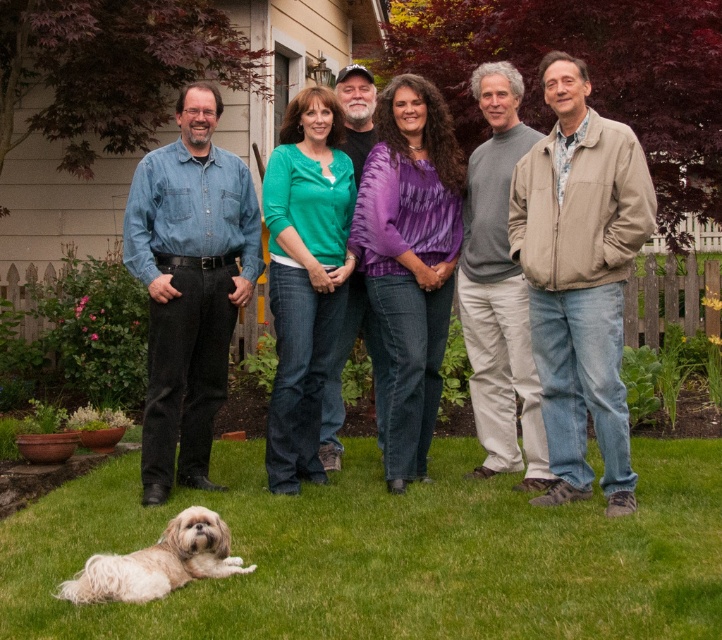
Is point (570, 461) closer to camera compared to point (609, 168)?

No, it is behind (609, 168).

Is denim shirt at center positioned before tan suede jacket at right?

No, denim shirt at center is further to the viewer.

What do you see at coordinates (583, 288) in the screenshot? Image resolution: width=722 pixels, height=640 pixels. I see `denim shirt at center` at bounding box center [583, 288].

I want to click on denim shirt at center, so click(x=583, y=288).

Consider the image. Is green grass at lower center above tan suede jacket at right?

Incorrect, green grass at lower center is not positioned above tan suede jacket at right.

Is green grass at lower center below tan suede jacket at right?

Yes, green grass at lower center is below tan suede jacket at right.

At what (x,y) coordinates should I click in order to perform the action: click on green grass at lower center. Please return your answer as a coordinate pair (x, y). Looking at the image, I should click on (388, 554).

Is point (8, 518) farther from viewer compared to point (97, 593)?

Yes.

Does green grass at lower center appear over white fluffy dog at lower left?

Incorrect, green grass at lower center is not positioned above white fluffy dog at lower left.

Identify the location of green grass at lower center. This screenshot has height=640, width=722. (388, 554).